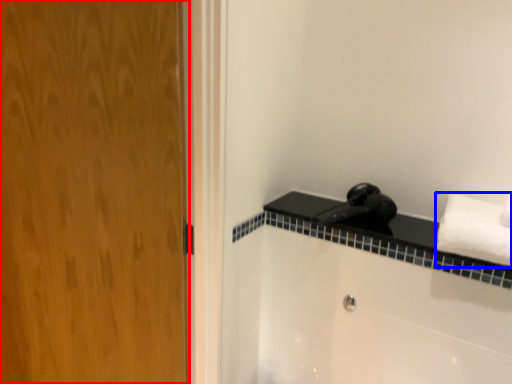
Question: Which object appears closest to the camera in this image, door (highlighted by a red box) or towel (highlighted by a blue box)?

Choices:
 (A) door
 (B) towel

Answer: (A)